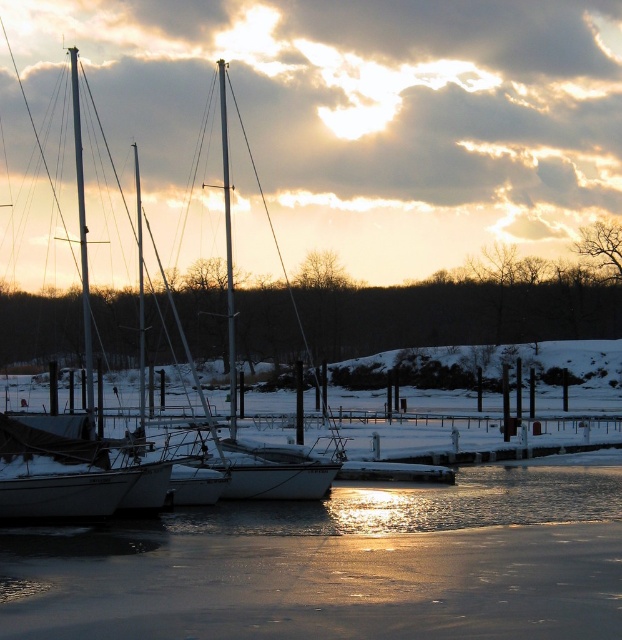
Does icy white water at center appear over white matte sailboat at center?

Incorrect, icy white water at center is not positioned above white matte sailboat at center.

Between point (239, 570) and point (223, 192), which one is positioned in front?

Positioned in front is point (239, 570).

Where is `icy white water at center`? icy white water at center is located at coordinates (341, 564).

At what (x,y) coordinates should I click in order to perform the action: click on icy white water at center. Please return your answer as a coordinate pair (x, y). Looking at the image, I should click on (341, 564).